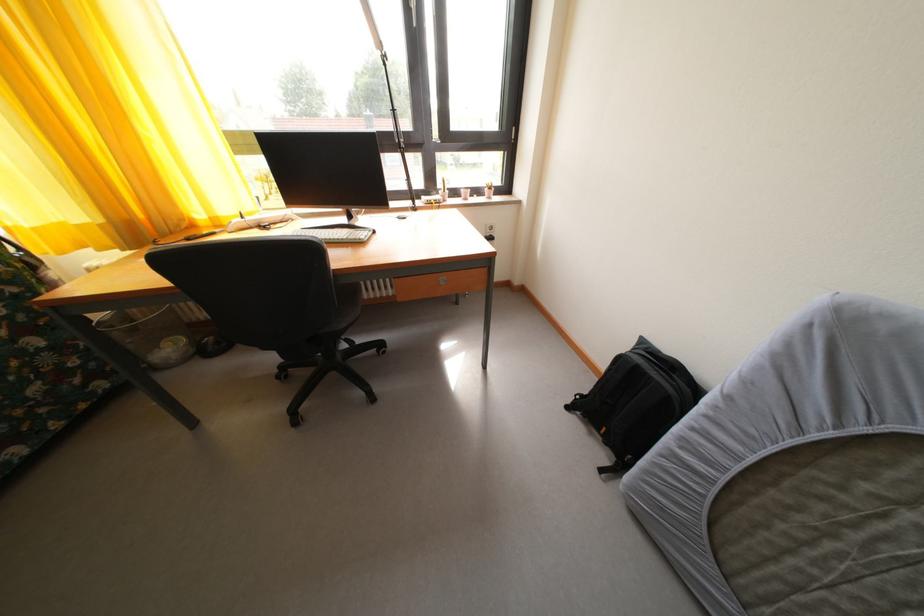
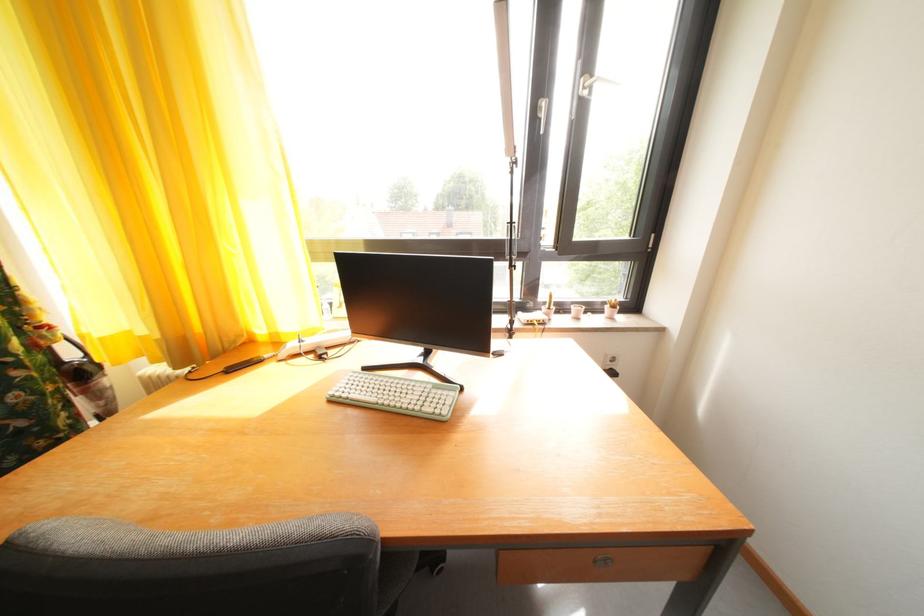
From the picture: Which direction would the cameraman need to move to produce the second image?

The cameraman moved toward left, forward.